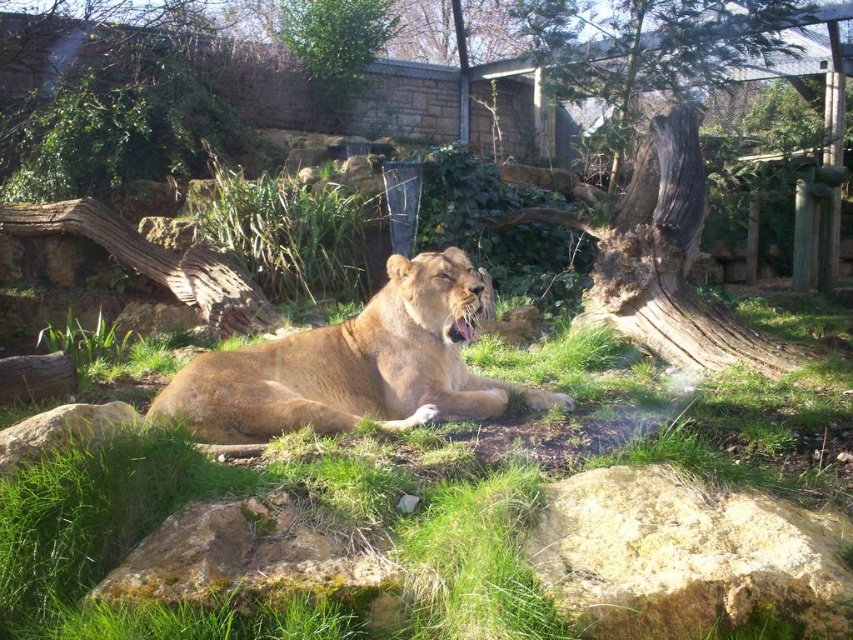
Question: Where is brown textured wood at center located in relation to golden fur lion at center in the image?

Choices:
 (A) right
 (B) left

Answer: (A)

Question: Which point is closer to the camera?

Choices:
 (A) (x=637, y=314)
 (B) (x=149, y=512)

Answer: (B)

Question: Estimate the real-world distances between objects in this image. Which object is farther from the yellowish rock at lower right?

Choices:
 (A) green grass at center
 (B) golden fur lion at center

Answer: (B)

Question: Does brown textured wood at center have a smaller size compared to yellowish rock at lower right?

Choices:
 (A) yes
 (B) no

Answer: (B)

Question: Among these points, which one is nearest to the camera?

Choices:
 (A) pos(671,113)
 (B) pos(311,422)
 (C) pos(839,406)
 (D) pos(566,554)

Answer: (D)

Question: Can you confirm if brown textured wood at center is smaller than yellowish rock at lower right?

Choices:
 (A) yes
 (B) no

Answer: (B)